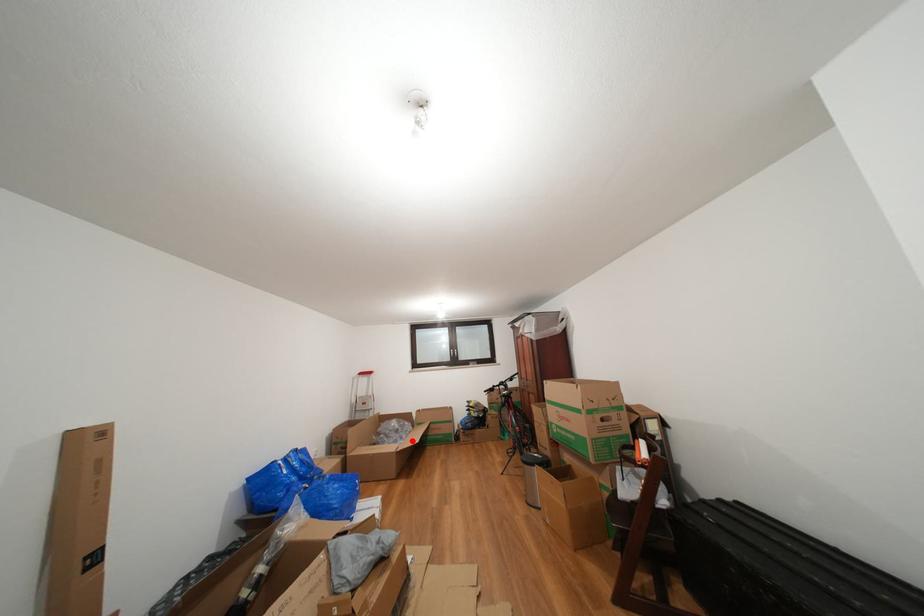
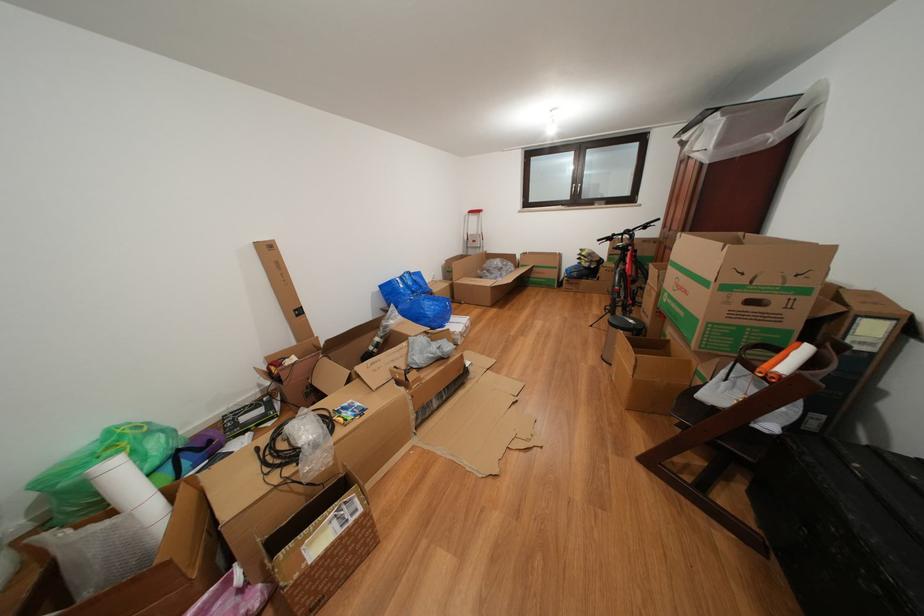
Find the pixel in the second image that matches the highlighted location in the first image.

(513, 280)